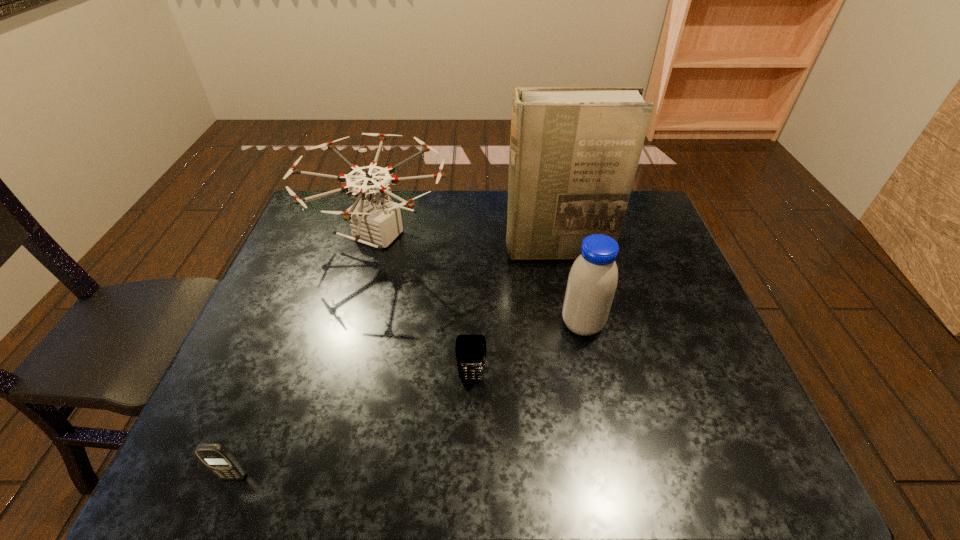
At what (x,y) coordinates should I click in order to perform the action: click on free space between the drone and the third nearest object. Please return your answer as a coordinate pair (x, y). This screenshot has height=540, width=960. Looking at the image, I should click on (481, 280).

Locate an element on the screen. This screenshot has height=540, width=960. vacant area that lies between the drone and the second shortest object is located at coordinates (425, 307).

Identify the location of vacant space in between the fourth farthest object and the drone. The height and width of the screenshot is (540, 960). (425, 307).

The image size is (960, 540). I want to click on empty location between the taller cellular telephone and the drone, so click(x=425, y=307).

Find the location of a particular element. The height and width of the screenshot is (540, 960). vacant space in between the fourth tallest object and the drone is located at coordinates (425, 307).

This screenshot has width=960, height=540. Find the location of `empty space between the drone and the tallest object`. empty space between the drone and the tallest object is located at coordinates (468, 243).

Locate an element on the screen. vacant space that's between the tallest object and the nearest object is located at coordinates (396, 363).

Find the location of a particular element. vacant space in between the fourth farthest object and the third farthest object is located at coordinates (527, 351).

This screenshot has width=960, height=540. In order to click on vacant area that lies between the right cellular telephone and the third farthest object in this screenshot , I will do `click(527, 351)`.

Locate which object is the closest to the left cellular telephone. Please provide its 2D coordinates. Your answer should be formatted as a tuple, i.e. [(x, y)], where the tuple contains the x and y coordinates of a point satisfying the conditions above.

[(470, 349)]